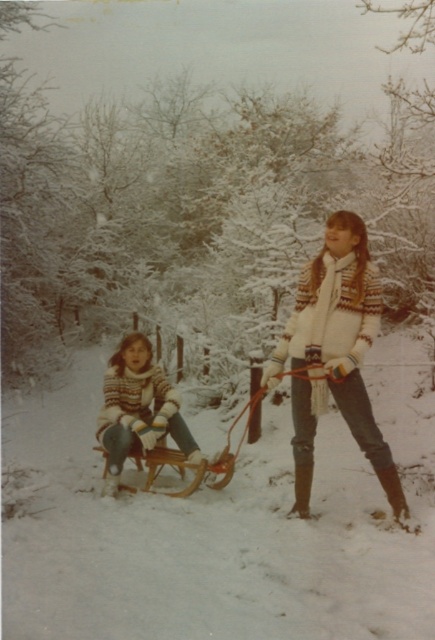
Question: In this image, where is white knitted sweater at center located relative to wooden sled at center?

Choices:
 (A) below
 (B) above

Answer: (B)

Question: Which of the following is the closest to the observer?

Choices:
 (A) wooden sled at center
 (B) white wool sweater at center
 (C) white knitted sweater at center

Answer: (C)

Question: Which of these objects is positioned farthest from the white wool sweater at center?

Choices:
 (A) wooden sled at center
 (B) white knitted sweater at center

Answer: (B)

Question: Estimate the real-world distances between objects in this image. Which object is farther from the white wool sweater at center?

Choices:
 (A) wooden sled at center
 (B) white knitted sweater at center

Answer: (B)

Question: Is white knitted sweater at center to the right of wooden sled at center from the viewer's perspective?

Choices:
 (A) no
 (B) yes

Answer: (B)

Question: Is white wool sweater at center to the right of wooden sled at center from the viewer's perspective?

Choices:
 (A) yes
 (B) no

Answer: (B)